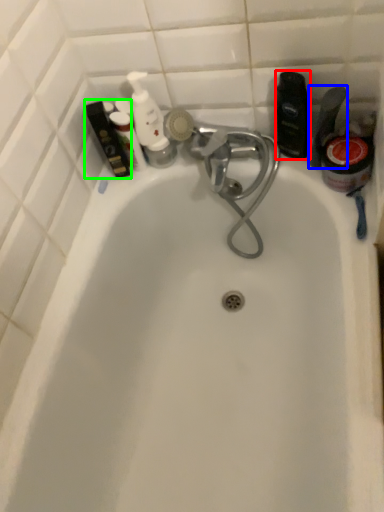
Question: Which object is positioned farthest from toiletry (highlighted by a red box)? Select from toiletry (highlighted by a blue box) and toiletry (highlighted by a green box).

Choices:
 (A) toiletry
 (B) toiletry

Answer: (B)